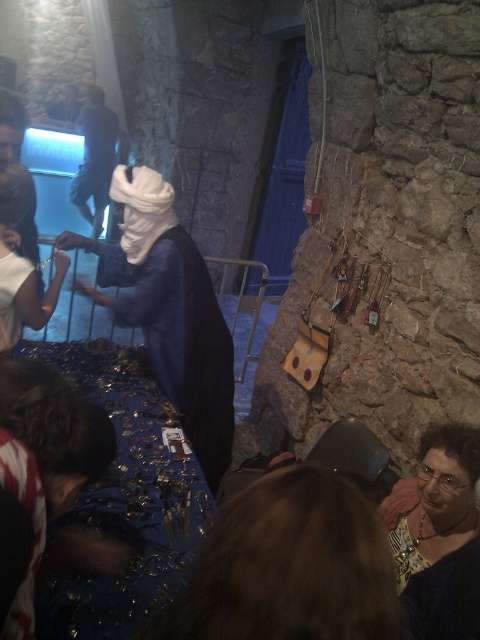
Question: Which object appears farthest from the camera in this image?

Choices:
 (A) dark blue fabric at center
 (B) matte blue dress at center
 (C) matte gold necklace at lower right

Answer: (A)

Question: Which point appears closest to the camera in this image?

Choices:
 (A) (434, 540)
 (B) (169, 374)
 (C) (94, 132)

Answer: (A)

Question: Can you confirm if matte blue dress at center is thinner than dark blue fabric at center?

Choices:
 (A) yes
 (B) no

Answer: (B)

Question: Which object is the farthest from the dark blue fabric at center?

Choices:
 (A) matte blue dress at center
 (B) matte gold necklace at lower right

Answer: (B)

Question: Does matte blue dress at center appear on the left side of matte gold necklace at lower right?

Choices:
 (A) no
 (B) yes

Answer: (B)

Question: Can you confirm if matte blue dress at center is thinner than matte gold necklace at lower right?

Choices:
 (A) no
 (B) yes

Answer: (A)